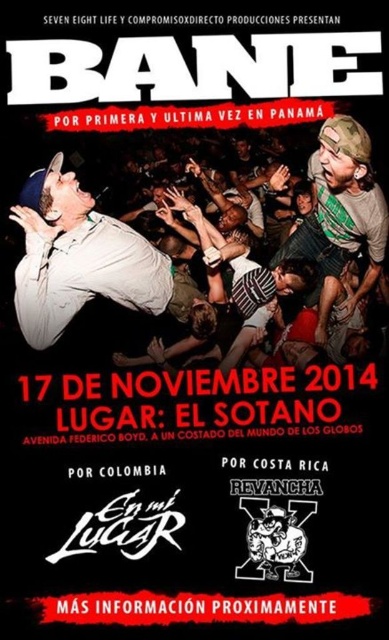
You are designing a new promotional poster and need to ensure the text elements are properly sized for readability. The poster currently has a matte white shirt at upper left and a white matte shirt at center. Which shirt should you make larger to maintain visual hierarchy?

The matte white shirt at upper left is already larger than the white matte shirt at center, so to maintain visual hierarchy, you should keep it as the larger one.

You are designing a promotional poster and notice two white matte shirts in the design. The first is the matte white shirt at upper left, and the second is the white matte shirt at center. Which shirt is located to the right of the other?

The matte white shirt at upper left is positioned on the right side of the white matte shirt at center, so the matte white shirt at upper left is to the right of the white matte shirt at center.

You are designing a new promotional poster for Bane concert. You need to ensure that the matte white shirt at upper left and the white matte shirt at center are visible to all attendees. Considering their sizes, which shirt should be placed closer to the bottom of the poster for better visibility?

The white matte shirt at center should be placed closer to the bottom of the poster because it is shorter than the matte white shirt at upper left. Placing the shorter shirt lower ensures both are visible without one overpowering the other.